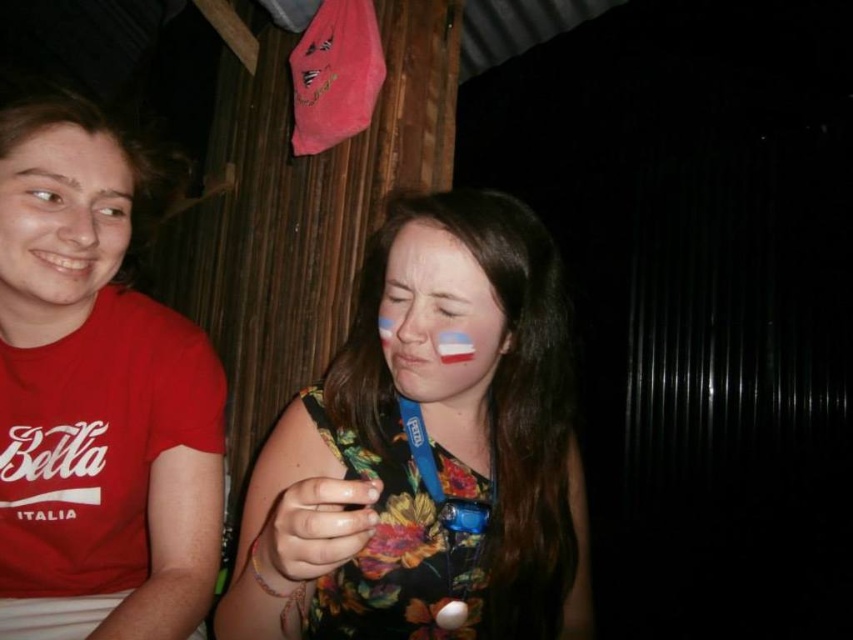
Question: Is floral fabric dress at center behind white matte face paint at center?

Choices:
 (A) yes
 (B) no

Answer: (B)

Question: Among these objects, which one is farthest from the camera?

Choices:
 (A) matte red shirt at left
 (B) white matte face paint at center

Answer: (A)

Question: Can you confirm if matte red t-shirt at left is positioned above white matte face paint at center?

Choices:
 (A) yes
 (B) no

Answer: (B)

Question: Estimate the real-world distances between objects in this image. Which object is closer to the white matte face paint at center?

Choices:
 (A) floral fabric dress at center
 (B) matte red t-shirt at left

Answer: (A)

Question: Which object is closer to the camera taking this photo?

Choices:
 (A) floral fabric dress at center
 (B) white matte face paint at center

Answer: (A)

Question: Is matte red t-shirt at left below matte red shirt at left?

Choices:
 (A) no
 (B) yes

Answer: (B)